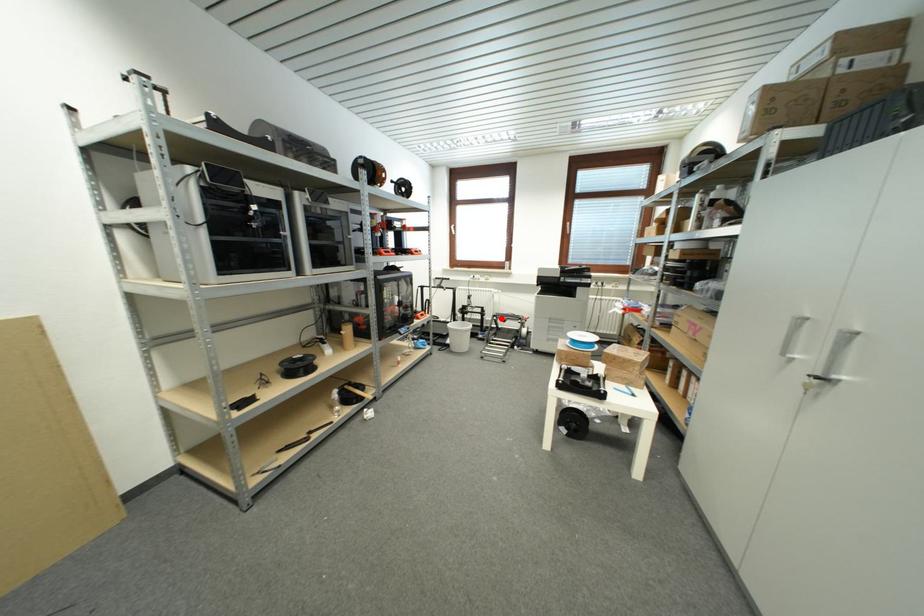
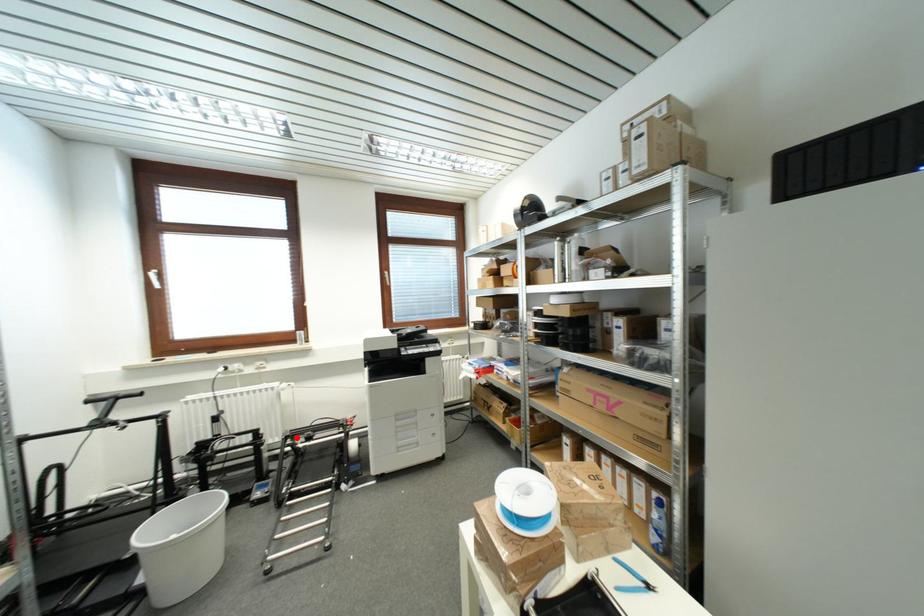
I am providing you with two images of the same scene from different viewpoints. A red point is marked on the first image and another point is marked on the second image. Do the highlighted points in image1 and image2 indicate the same real-world spot?

Yes